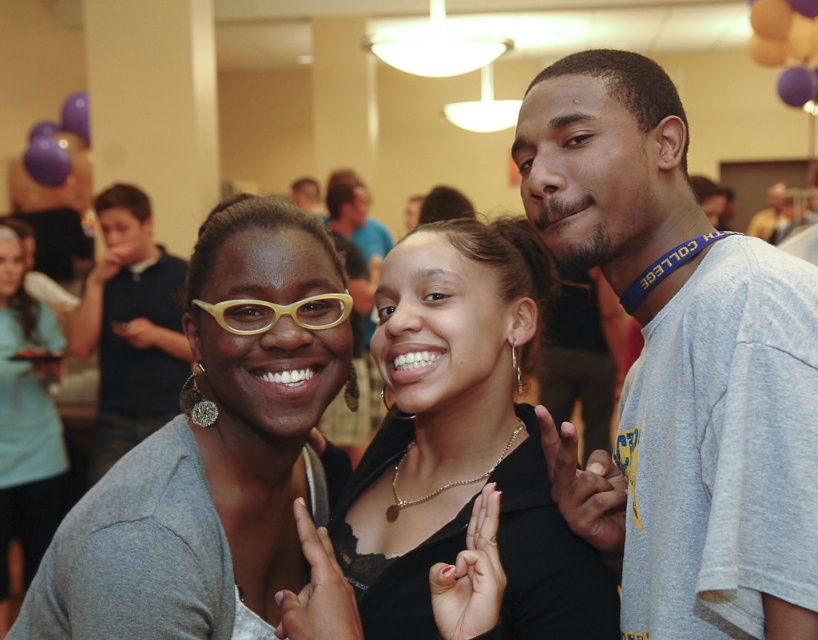
Between matte white glasses at left and matte gray sweater at center, which one has more height?

With more height is matte gray sweater at center.

Is point (102, 628) behind point (18, 518)?

No, it is not.

Locate an element on the screen. matte white glasses at left is located at coordinates (210, 458).

Where is `matte white glasses at left`? matte white glasses at left is located at coordinates (210, 458).

Between matte black shirt at center and matte gray sweater at center, which one has less height?

Standing shorter between the two is matte black shirt at center.

You are a GUI agent. You are given a task and a screenshot of the screen. Output one action in this format:
    pyautogui.click(x=<x>, y=<y>)
    Task: Click on the matte black shirt at center
    This screenshot has height=640, width=818.
    Given the screenshot: What is the action you would take?
    pyautogui.click(x=454, y=465)

The height and width of the screenshot is (640, 818). I want to click on matte black shirt at center, so tap(454, 465).

Between matte black shirt at center and matte white glasses at left, which one is positioned lower?

Positioned lower is matte black shirt at center.

Between matte black shirt at center and matte white glasses at left, which one appears on the right side from the viewer's perspective?

matte black shirt at center

Identify the location of matte black shirt at center. The image size is (818, 640). (454, 465).

This screenshot has width=818, height=640. I want to click on matte black shirt at center, so click(x=454, y=465).